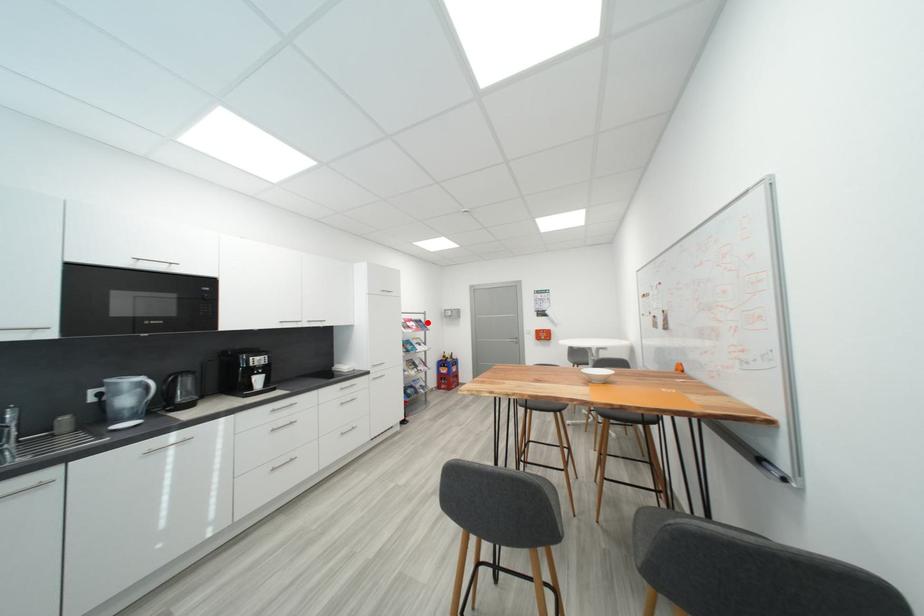
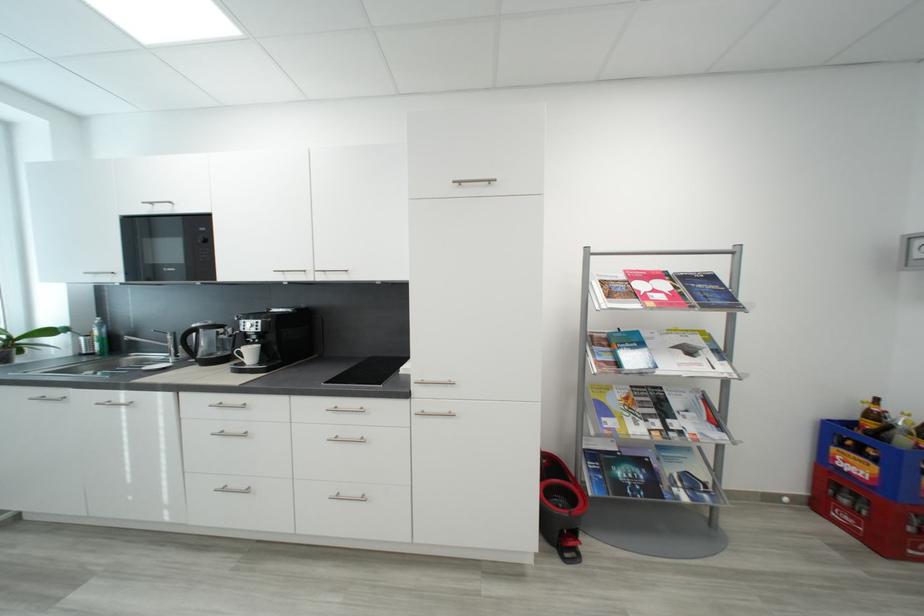
Locate, in the second image, the point that corresponds to the highlighted location in the first image.

(718, 280)